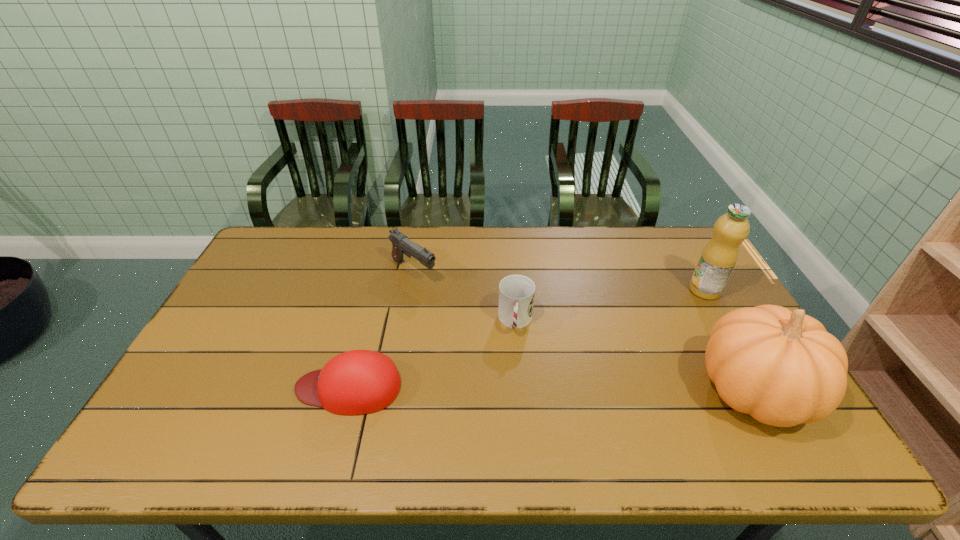
You are a GUI agent. You are given a task and a screenshot of the screen. Output one action in this format:
    pyautogui.click(x=<x>, y=<y>)
    Task: Click on the vacant area situated 0.160m on the side of the cup where the handle is located
    The image size is (960, 540).
    Given the screenshot: What is the action you would take?
    pyautogui.click(x=513, y=387)

You are a GUI agent. You are given a task and a screenshot of the screen. Output one action in this format:
    pyautogui.click(x=<x>, y=<y>)
    Task: Click on the vacant space located on the side of the cup where the handle is located
    
    Given the screenshot: What is the action you would take?
    pyautogui.click(x=511, y=421)

You are a GUI agent. You are given a task and a screenshot of the screen. Output one action in this format:
    pyautogui.click(x=<x>, y=<y>)
    Task: Click on the vacant space located 0.170m on the side of the cup where the handle is located
    
    Given the screenshot: What is the action you would take?
    point(513,390)

Identify the location of vacant space located 0.240m on the front label of the fruit juice. This screenshot has height=540, width=960. (644, 327).

Where is `free region located 0.280m on the front label of the fruit juice`? free region located 0.280m on the front label of the fruit juice is located at coordinates (635, 333).

This screenshot has height=540, width=960. In order to click on vacant space located on the front label of the fruit juice in this screenshot , I will do `click(684, 303)`.

Locate an element on the screen. The height and width of the screenshot is (540, 960). free space located 0.110m in the direction the gun is aimed is located at coordinates (453, 299).

What are the coordinates of `blank space located in the direction the gun is aimed` in the screenshot? It's located at (465, 307).

Image resolution: width=960 pixels, height=540 pixels. In order to click on vacant region located in the direction the gun is aimed in this screenshot , I will do [x=505, y=336].

The width and height of the screenshot is (960, 540). I want to click on object that is at the far edge, so click(401, 245).